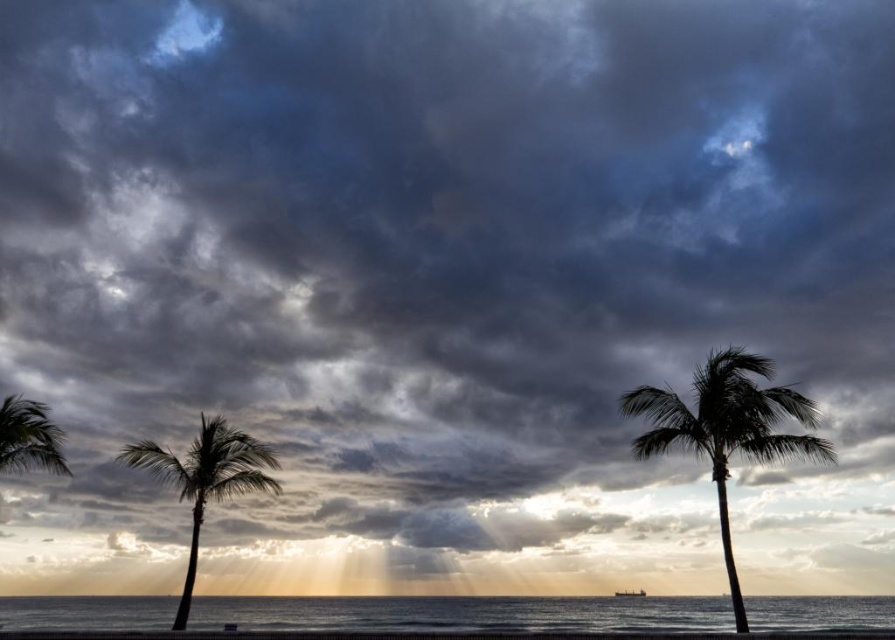
Which is more to the left, silhouette palm tree at right or green leafy palm tree at lower left?

From the viewer's perspective, green leafy palm tree at lower left appears more on the left side.

In order to click on silhouette palm tree at right in this screenshot , I will do `click(726, 428)`.

Does clear water at lower center have a greater width compared to silky brown palm tree at left?

Yes, clear water at lower center is wider than silky brown palm tree at left.

Who is shorter, clear water at lower center or silky brown palm tree at left?

silky brown palm tree at left is shorter.

You are a GUI agent. You are given a task and a screenshot of the screen. Output one action in this format:
    pyautogui.click(x=<x>, y=<y>)
    Task: Click on the clear water at lower center
    This screenshot has width=895, height=640.
    Given the screenshot: What is the action you would take?
    pyautogui.click(x=461, y=614)

The height and width of the screenshot is (640, 895). I want to click on clear water at lower center, so click(x=461, y=614).

Based on the photo, which is above, clear water at lower center or green leafy palm tree at lower left?

green leafy palm tree at lower left

Is clear water at lower center above green leafy palm tree at lower left?

No.

Who is more distant from viewer, (785, 609) or (1, 420)?

The point (785, 609) is more distant.

What are the coordinates of `clear water at lower center` in the screenshot? It's located at (461, 614).